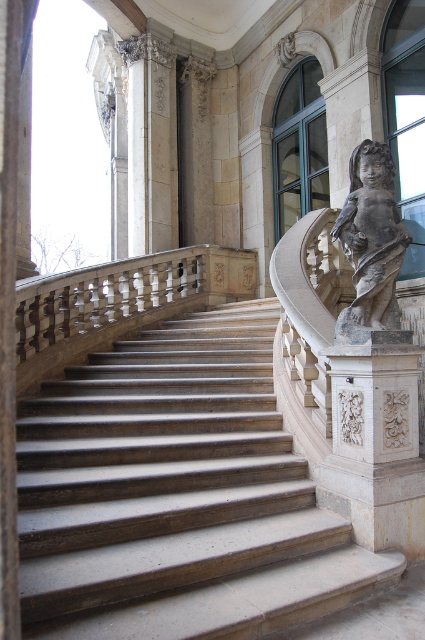
You are standing at the base of the staircase and want to take a photo of the point at coordinate (x=62, y=630). If your camera has a focal length of 50mm and you need the subject to fill the frame, will you need to move closer or farther away?

The point at coordinate (x=62, y=630) is 2.70 meters away from the camera. To fill the frame with the subject using a 50mm lens, you would typically need to be closer than 2.70 meters. Therefore, you should move closer to the point at coordinate (x=62, y=630) to fill the frame.

You are an architect inspecting the grand staircase and the statue. From your current position, which object is closer to you, the smooth stone stairs at center or the gray stone cherub at right?

The smooth stone stairs at center is closer to you because it is in front of the gray stone cherub at right.

You are an architect assessing the proportions of the grand staircase and the statue. Which object takes up more space in the image, the smooth stone stairs at center or the gray stone cherub at right?

The smooth stone stairs at center is bigger than the gray stone cherub at right, so the smooth stone stairs at center takes up more space in the image.